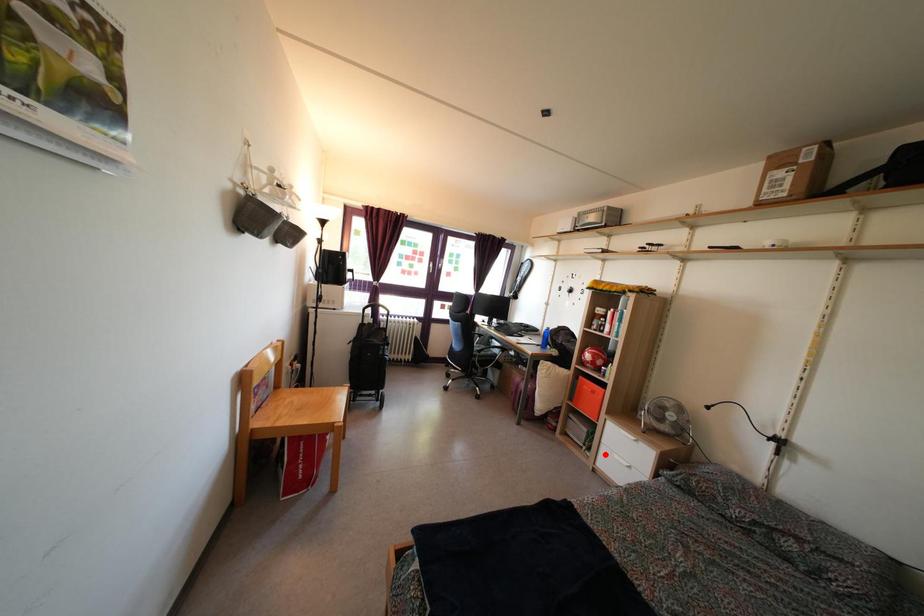
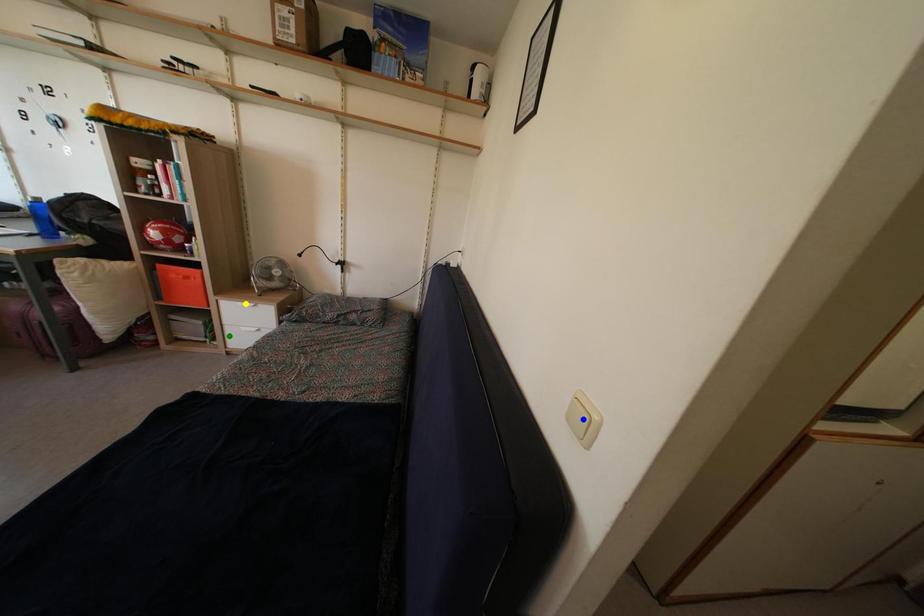
Question: I am providing you with two images of the same scene from different viewpoints. A red point is marked on the first image. You are given multiple points on the second image. Which point in image 2 is actually the same real-world point as the red point in image 1?

Choices:
 (A) yellow point
 (B) green point
 (C) blue point

Answer: (B)